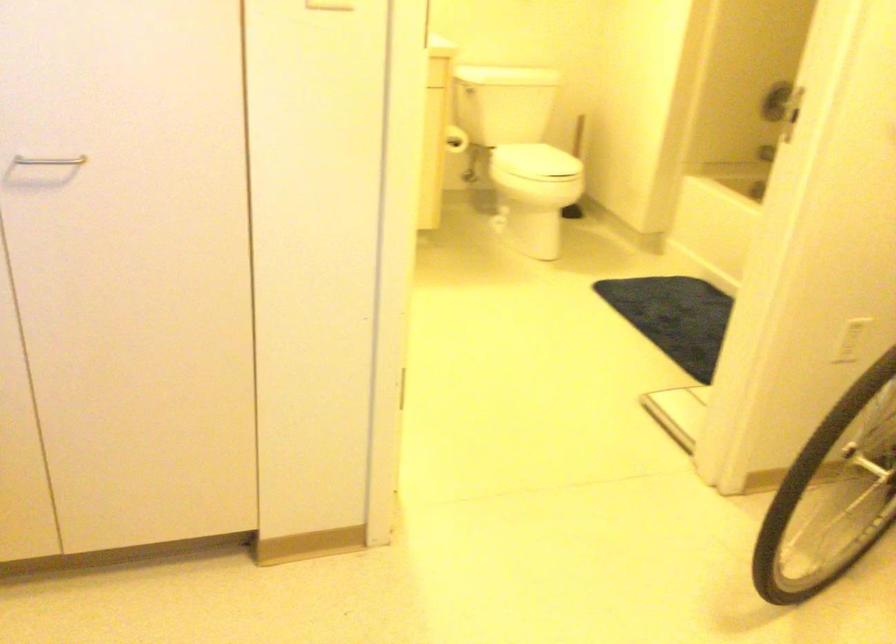
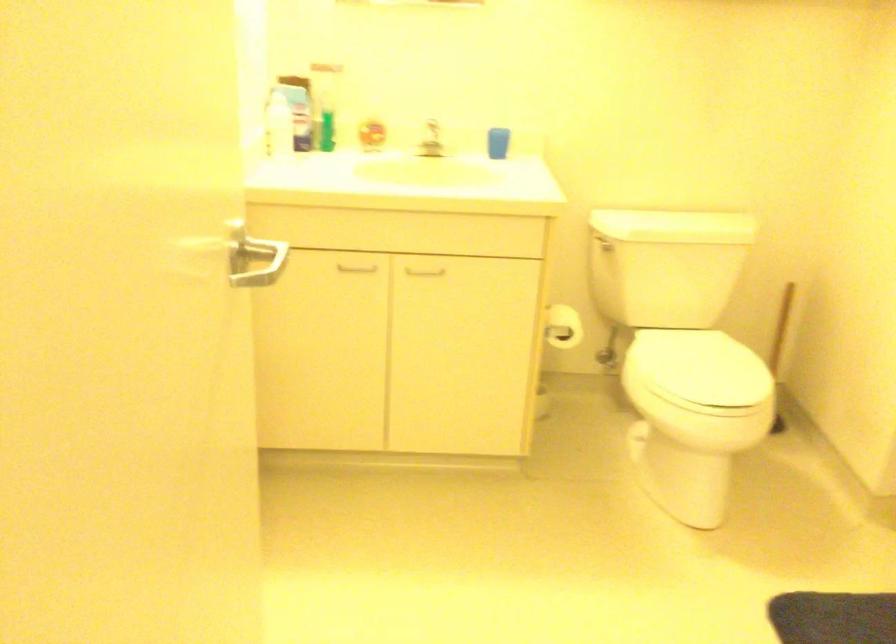
Find the pixel in the second image that matches point (579, 140) in the first image.

(780, 328)